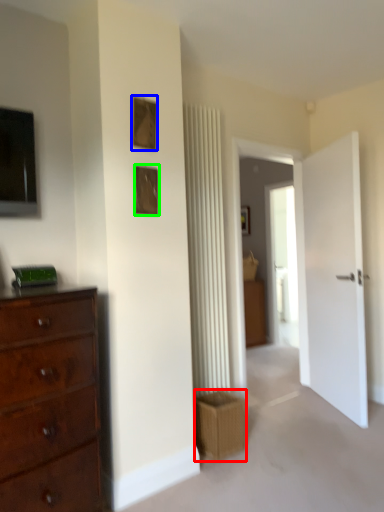
Question: Considering the real-world distances, which object is farthest from crate (highlighted by a red box)? picture frame (highlighted by a blue box) or picture frame (highlighted by a green box)?

Choices:
 (A) picture frame
 (B) picture frame

Answer: (A)